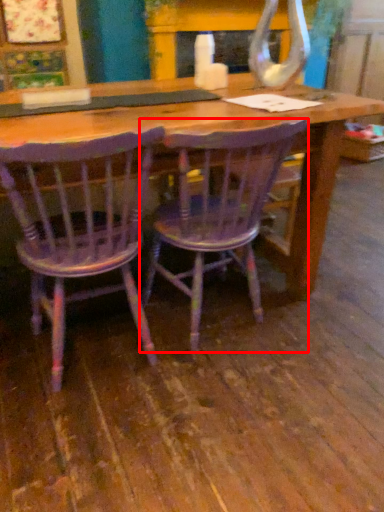
Question: From the image's perspective, what is the correct spatial positioning of chair (annotated by the red box) in reference to chair?

Choices:
 (A) above
 (B) below

Answer: (A)